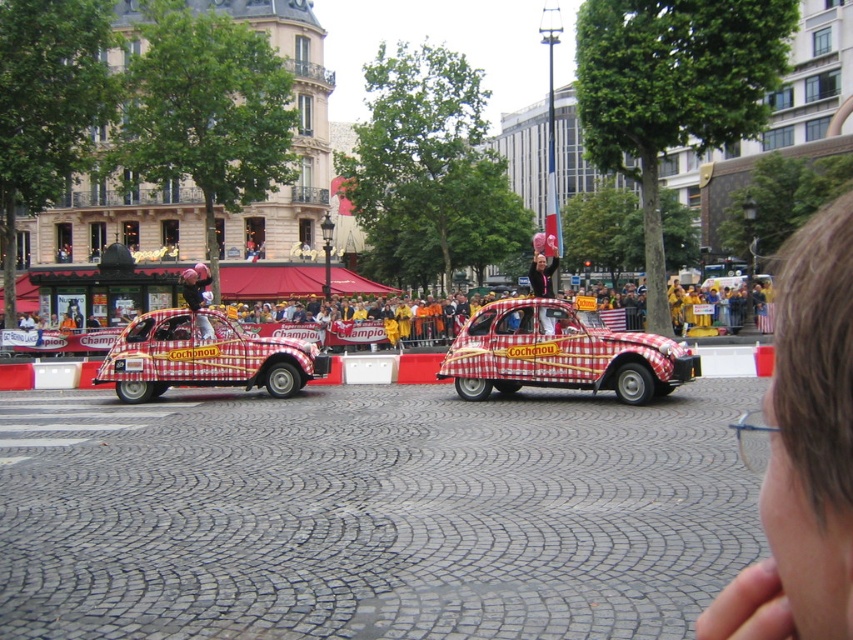
Which is above, matte red car at center or matte pink shirt at left?

matte pink shirt at left is above.

In the scene shown: Between matte red car at center and matte pink shirt at left, which one appears on the left side from the viewer's perspective?

matte pink shirt at left is more to the left.

Who is more forward, (534,285) or (196,266)?

Point (534,285) is more forward.

Locate an element on the screen. Image resolution: width=853 pixels, height=640 pixels. matte red car at center is located at coordinates (541, 268).

Who is taller, checkered fabric taxi at center or checkered fabric taxi at left?

checkered fabric taxi at left is taller.

Can you confirm if checkered fabric taxi at center is shorter than checkered fabric taxi at left?

Yes, checkered fabric taxi at center is shorter than checkered fabric taxi at left.

What do you see at coordinates (561, 355) in the screenshot? I see `checkered fabric taxi at center` at bounding box center [561, 355].

Where is `checkered fabric taxi at center`? The width and height of the screenshot is (853, 640). checkered fabric taxi at center is located at coordinates (561, 355).

In the scene shown: Who is more distant from viewer, (270, 358) or (187, 280)?

Point (187, 280)

Is checkered fabric taxi at left bigger than matte pink shirt at left?

Incorrect, checkered fabric taxi at left is not larger than matte pink shirt at left.

Find the location of `checkered fabric taxi at left`. checkered fabric taxi at left is located at coordinates (204, 356).